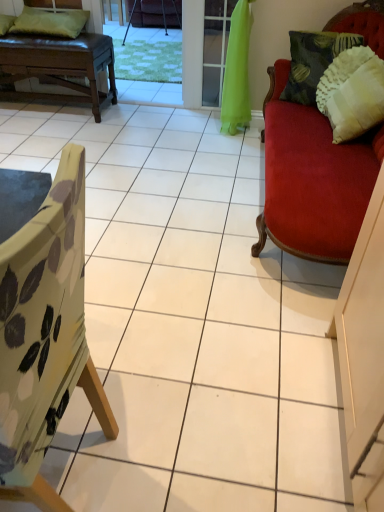
Question: Does green fabric screen door at center come behind brown leather bench at upper left?

Choices:
 (A) no
 (B) yes

Answer: (B)

Question: Can we say green fabric screen door at center lies outside brown leather bench at upper left?

Choices:
 (A) no
 (B) yes

Answer: (B)

Question: Could you tell me if green fabric screen door at center is turned towards brown leather bench at upper left?

Choices:
 (A) no
 (B) yes

Answer: (A)

Question: Does green fabric screen door at center have a larger size compared to brown leather bench at upper left?

Choices:
 (A) yes
 (B) no

Answer: (B)

Question: Considering the relative positions of green fabric screen door at center and brown leather bench at upper left in the image provided, is green fabric screen door at center in front of brown leather bench at upper left?

Choices:
 (A) yes
 (B) no

Answer: (B)

Question: Is metallic tripod at center, the first chair positioned from the top, wider or thinner than green fabric pillow at upper left, which ranks as the 1th pillow in left-to-right order?

Choices:
 (A) thin
 (B) wide

Answer: (B)

Question: From the image's perspective, is metallic tripod at center, the first chair from the back, above or below green fabric pillow at upper left, which is counted as the 3th pillow, starting from the right?

Choices:
 (A) above
 (B) below

Answer: (A)

Question: From a real-world perspective, is metallic tripod at center, the first chair positioned from the top, above or below green fabric pillow at upper left, which is counted as the 3th pillow, starting from the right?

Choices:
 (A) above
 (B) below

Answer: (B)

Question: Considering their positions, is metallic tripod at center, placed as the 2th chair when sorted from front to back, located in front of or behind green fabric pillow at upper left, which is counted as the 3th pillow, starting from the right?

Choices:
 (A) behind
 (B) front

Answer: (A)

Question: In the image, is brown leather bench at upper left positioned in front of or behind green fabric screen door at center?

Choices:
 (A) front
 (B) behind

Answer: (A)

Question: Visually, is brown leather bench at upper left positioned to the left or to the right of green fabric screen door at center?

Choices:
 (A) left
 (B) right

Answer: (A)

Question: From a real-world perspective, is brown leather bench at upper left positioned above or below green fabric screen door at center?

Choices:
 (A) above
 (B) below

Answer: (B)

Question: In terms of width, does brown leather bench at upper left look wider or thinner when compared to green fabric screen door at center?

Choices:
 (A) thin
 (B) wide

Answer: (B)

Question: Is metallic tripod at center, placed as the 2th chair when sorted from front to back, bigger or smaller than green fabric screen door at center?

Choices:
 (A) big
 (B) small

Answer: (A)

Question: From a real-world perspective, is metallic tripod at center, the first chair from the back, positioned above or below green fabric screen door at center?

Choices:
 (A) above
 (B) below

Answer: (B)